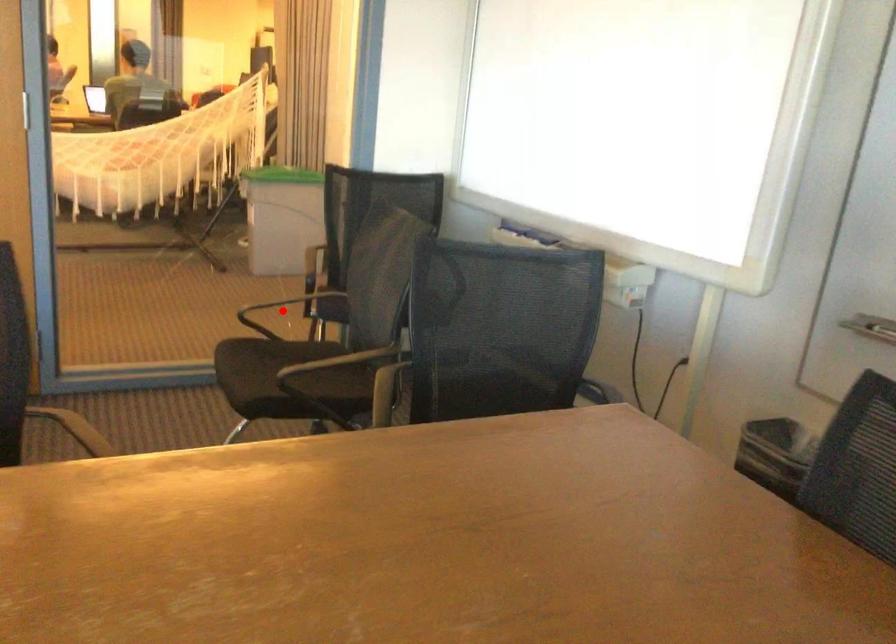
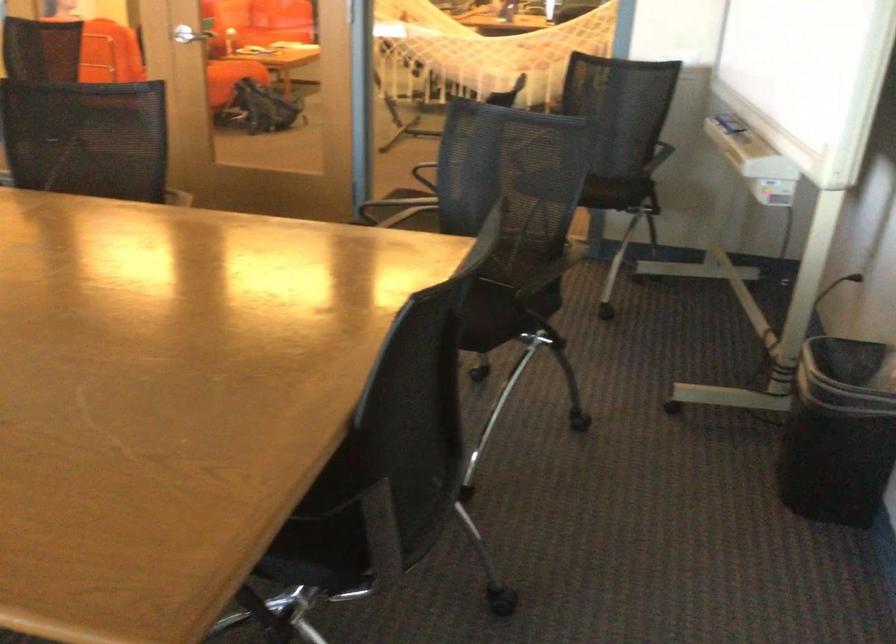
Question: I am providing you with two images of the same scene from different viewpoints. A red point is marked on the first image. At the location where the point appears in image 1, is it still visible in image 2?

Choices:
 (A) Yes
 (B) No

Answer: (B)